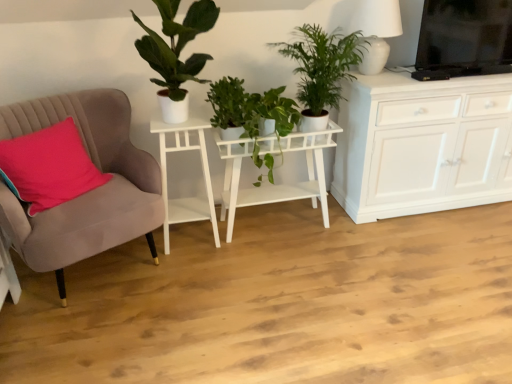
Question: From the image's perspective, would you say green glossy plant at center, which appears as the second houseplant when viewed from the right, is shown under white matte side table at left, which is counted as the 1th table, starting from the left?

Choices:
 (A) no
 (B) yes

Answer: (A)

Question: Considering the relative sizes of green glossy plant at center, which appears as the second houseplant when viewed from the right, and white matte side table at left, placed as the second table when sorted from right to left, in the image provided, is green glossy plant at center, which appears as the second houseplant when viewed from the right, taller than white matte side table at left, placed as the second table when sorted from right to left,?

Choices:
 (A) no
 (B) yes

Answer: (A)

Question: Can you confirm if green glossy plant at center, the second houseplant viewed from the left, is smaller than white matte side table at left, placed as the second table when sorted from right to left?

Choices:
 (A) yes
 (B) no

Answer: (A)

Question: Could you tell me if green glossy plant at center, which appears as the second houseplant when viewed from the right, is facing white matte side table at left, placed as the second table when sorted from right to left?

Choices:
 (A) no
 (B) yes

Answer: (A)

Question: From a real-world perspective, does green glossy plant at center, which appears as the second houseplant when viewed from the right, stand above white matte side table at left, which is counted as the 1th table, starting from the left?

Choices:
 (A) no
 (B) yes

Answer: (B)

Question: From a real-world perspective, is green glossy plant at center, the second houseplant viewed from the left, physically located above or below green leafy plant at upper center, placed as the 3th houseplant when sorted from left to right?

Choices:
 (A) above
 (B) below

Answer: (B)

Question: From their relative heights in the image, would you say green glossy plant at center, the second houseplant viewed from the left, is taller or shorter than green leafy plant at upper center, marked as the first houseplant in a right-to-left arrangement?

Choices:
 (A) short
 (B) tall

Answer: (A)

Question: Is green glossy plant at center, which appears as the second houseplant when viewed from the right, to the left or to the right of green leafy plant at upper center, placed as the 3th houseplant when sorted from left to right, in the image?

Choices:
 (A) left
 (B) right

Answer: (A)

Question: Relative to green leafy plant at upper center, marked as the first houseplant in a right-to-left arrangement, is green glossy plant at center, which appears as the second houseplant when viewed from the right, in front or behind?

Choices:
 (A) behind
 (B) front

Answer: (A)

Question: Looking at the image, does pink fabric pillow at left seem bigger or smaller compared to green matte plant at upper left, which is counted as the third houseplant, starting from the right?

Choices:
 (A) big
 (B) small

Answer: (B)

Question: From the image's perspective, is pink fabric pillow at left above or below green matte plant at upper left, which is counted as the third houseplant, starting from the right?

Choices:
 (A) below
 (B) above

Answer: (A)

Question: Is pink fabric pillow at left inside or outside of green matte plant at upper left, which is counted as the third houseplant, starting from the right?

Choices:
 (A) outside
 (B) inside

Answer: (A)

Question: Is point (48, 185) closer or farther from the camera than point (161, 49)?

Choices:
 (A) closer
 (B) farther

Answer: (A)

Question: Considering the positions of point (0, 148) and point (276, 188), is point (0, 148) closer or farther from the camera than point (276, 188)?

Choices:
 (A) closer
 (B) farther

Answer: (A)

Question: Based on their sizes in the image, would you say pink fabric pillow at left is bigger or smaller than white matte plant stand at center, the first table positioned from the right?

Choices:
 (A) small
 (B) big

Answer: (A)